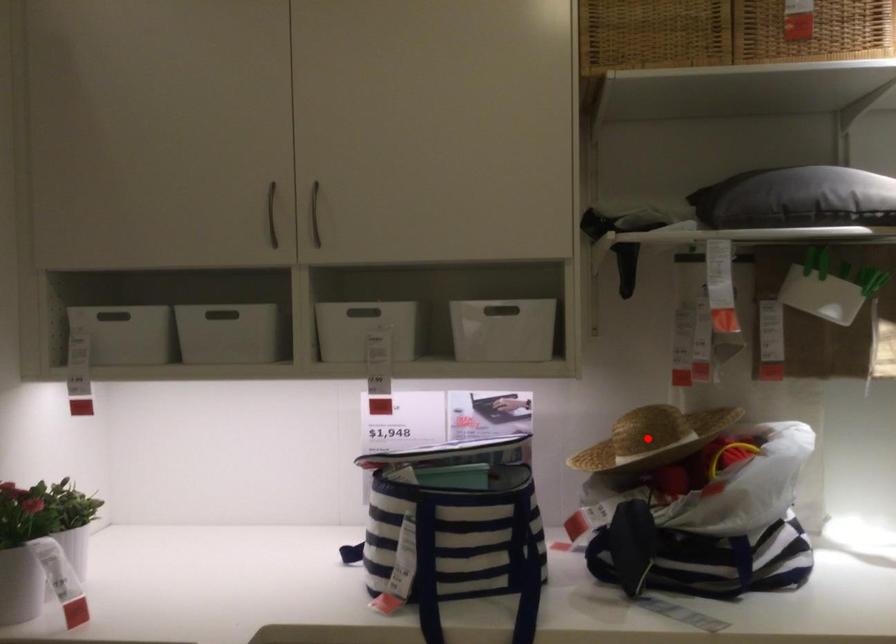
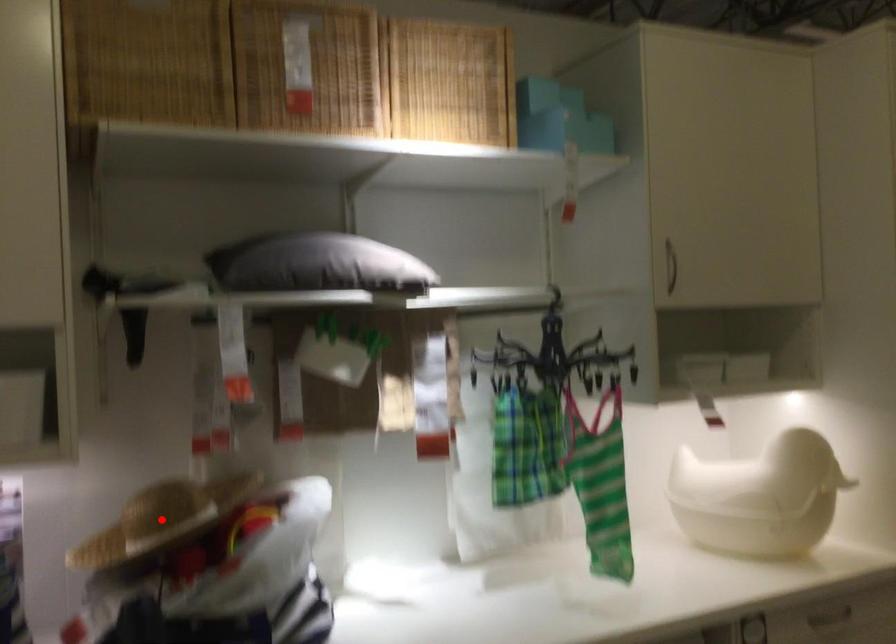
I am providing you with two images of the same scene from different viewpoints. A red point is marked on the first image and another point is marked on the second image. Is the marked point in image1 the same physical position as the marked point in image2?

Yes